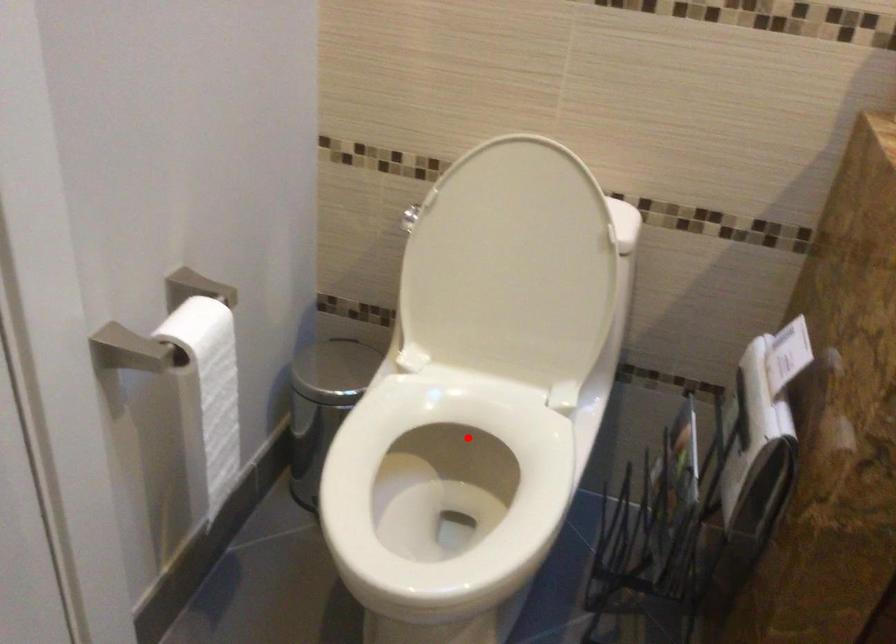
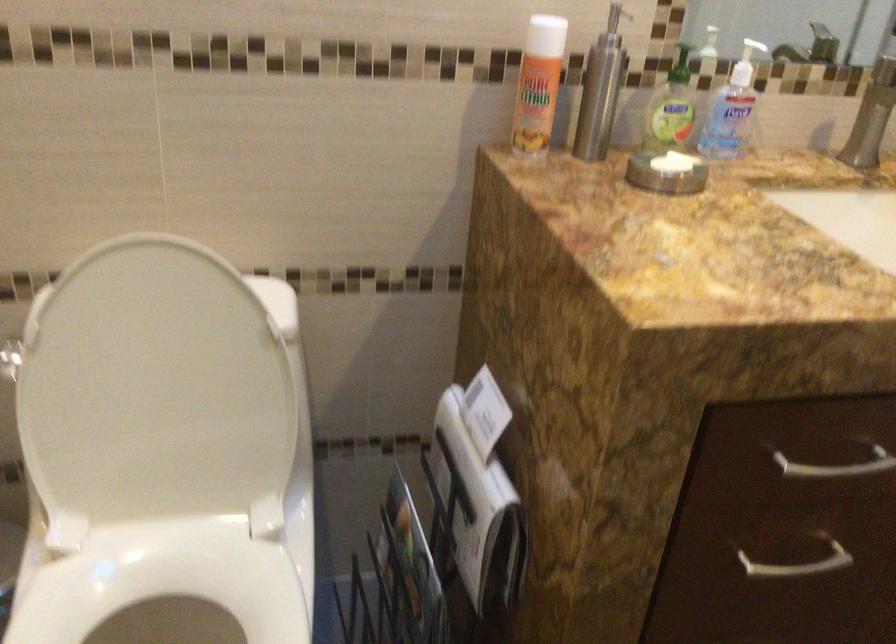
Question: I am providing you with two images of the same scene from different viewpoints. In image1, a red point is highlighted. Considering the same 3D point in image2, which of the following is correct?

Choices:
 (A) It is closer
 (B) It is farther

Answer: (A)